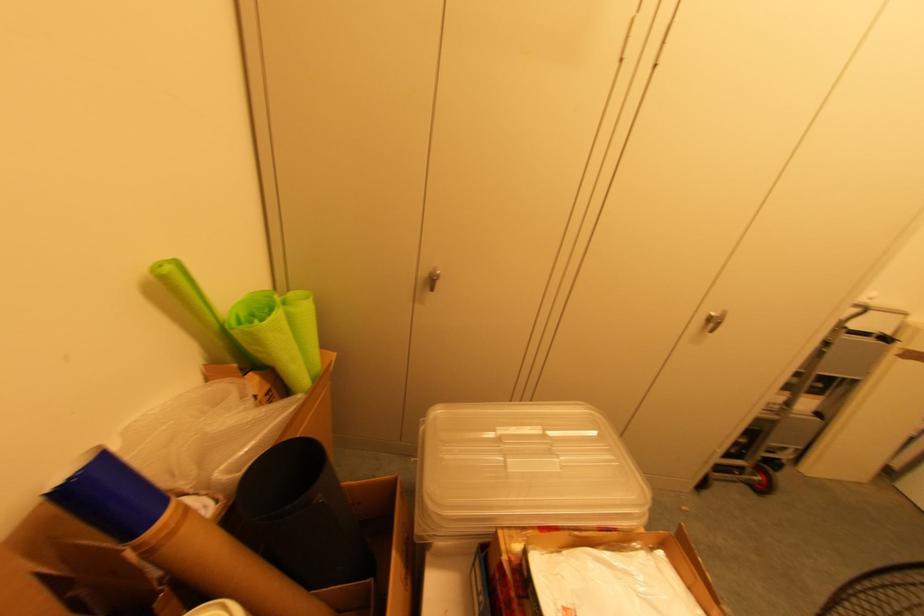
Find where to lift the cardboard tube. Please return your answer as a coordinate pair (x, y).

(176, 538)